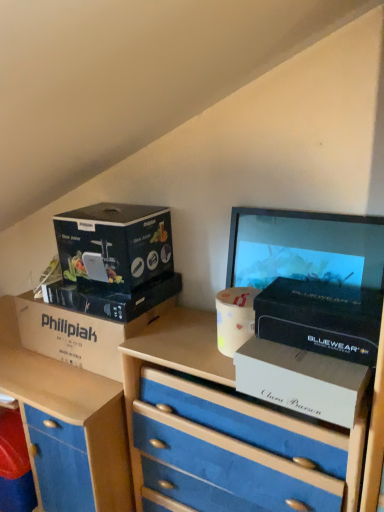
This screenshot has width=384, height=512. Find the location of `blank space situated above white cardboard box at center-right, which is counted as the 4th box, starting from the left (from a real-world perspective)`. blank space situated above white cardboard box at center-right, which is counted as the 4th box, starting from the left (from a real-world perspective) is located at coordinates (309, 354).